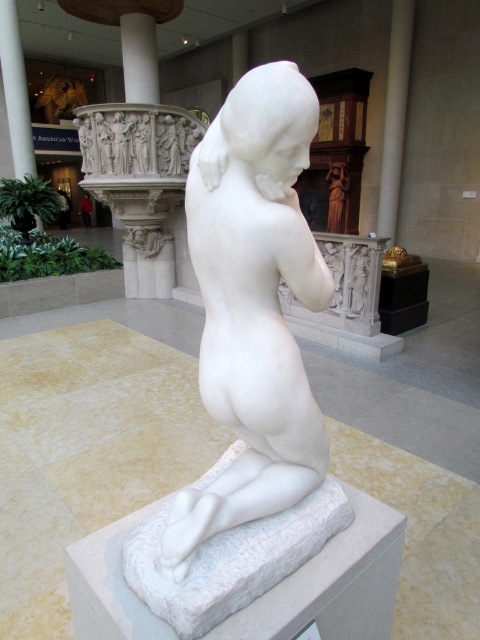
Does white marble statue at center have a lesser width compared to white marble pillar at center?

Correct, white marble statue at center's width is less than white marble pillar at center's.

Who is positioned more to the left, white marble statue at center or white marble pillar at center?

From the viewer's perspective, white marble statue at center appears more on the left side.

At what (x,y) coordinates should I click in order to perform the action: click on white marble statue at center. Please return your answer as a coordinate pair (x, y). This screenshot has height=640, width=480. Looking at the image, I should click on (252, 305).

Which is below, white marble statue at center or white marble pillar at left?

white marble statue at center is below.

Locate an element on the screen. This screenshot has height=640, width=480. white marble statue at center is located at coordinates (252, 305).

Where is `white marble statue at center`? The image size is (480, 640). white marble statue at center is located at coordinates (252, 305).

Is white marble pillar at center positioned behind white marble pillar at left?

No, it is not.

Is point (381, 163) in front of point (4, 24)?

No, (381, 163) is further to viewer.

Find the location of a particular element. white marble pillar at center is located at coordinates (395, 115).